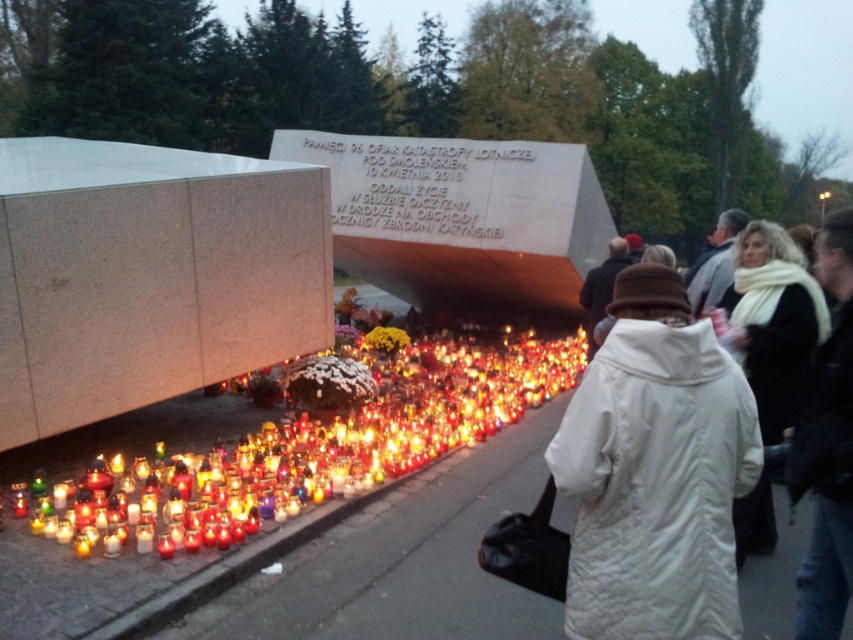
The image size is (853, 640). What are the coordinates of `white wool scarf at upper right` in the screenshot? It's located at (773, 321).

Who is higher up, white fluffy flowers at lower center or yellow fabric flowers at lower center?

yellow fabric flowers at lower center

Is white fluffy flowers at lower center in front of yellow fabric flowers at lower center?

Yes.

Measure the distance between white fluffy flowers at lower center and camera.

They are 21.68 feet apart.

This screenshot has height=640, width=853. Identify the location of white fluffy flowers at lower center. (328, 381).

Can you confirm if white wool scarf at upper right is thinner than white fluffy flowers at lower center?

Correct, white wool scarf at upper right's width is less than white fluffy flowers at lower center's.

The height and width of the screenshot is (640, 853). Identify the location of white wool scarf at upper right. tap(773, 321).